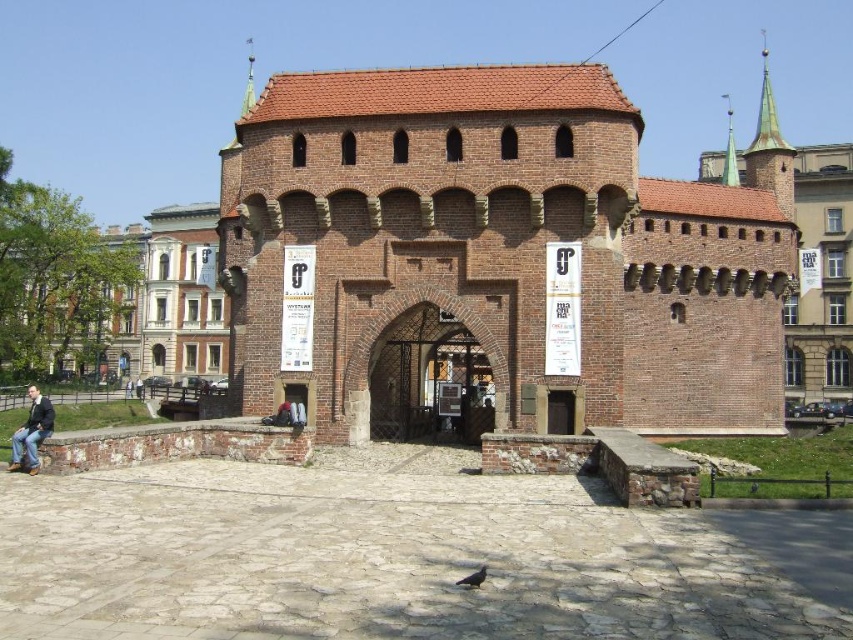
How much distance is there between jeans at lower left and dark blue jeans at lower left?

They are 123.22 feet apart.

Who is positioned more to the right, jeans at lower left or dark blue jeans at lower left?

jeans at lower left is more to the right.

Where is `jeans at lower left`? This screenshot has width=853, height=640. jeans at lower left is located at coordinates (32, 432).

Does brick gate at center appear over gray matte pigeon at center?

Yes, brick gate at center is above gray matte pigeon at center.

Is the position of brick gate at center more distant than that of gray matte pigeon at center?

Yes.

Locate an element on the screen. brick gate at center is located at coordinates (498, 252).

Where is `brick gate at center`? The image size is (853, 640). brick gate at center is located at coordinates (498, 252).

Can you confirm if brick gate at center is positioned below dark blue jeans at lower left?

Actually, brick gate at center is above dark blue jeans at lower left.

Between brick gate at center and dark blue jeans at lower left, which one appears on the left side from the viewer's perspective?

Positioned to the left is dark blue jeans at lower left.

Who is more forward, (350, 312) or (140, 385)?

Point (350, 312) is more forward.

What are the coordinates of `brick gate at center` in the screenshot? It's located at (498, 252).